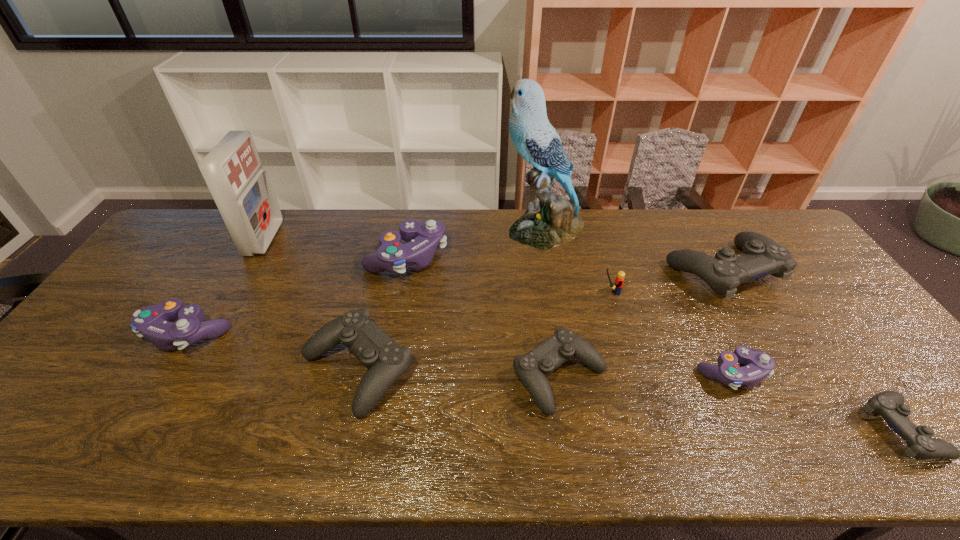
Where is `free region located on the front-facing side of the Lego`? The image size is (960, 540). free region located on the front-facing side of the Lego is located at coordinates (538, 292).

At what (x,y) coordinates should I click in order to perform the action: click on free space located on the front-facing side of the Lego. Please return your answer as a coordinate pair (x, y). The width and height of the screenshot is (960, 540). Looking at the image, I should click on (578, 292).

Where is `blank space located 0.110m on the right of the second biggest purple control`? This screenshot has width=960, height=540. blank space located 0.110m on the right of the second biggest purple control is located at coordinates (270, 333).

The width and height of the screenshot is (960, 540). In order to click on vacant space located on the back of the leftmost gray control in this screenshot , I will do [x=372, y=307].

Identify the location of free space located 0.120m on the left of the second gray control from left to right. (464, 376).

This screenshot has width=960, height=540. I want to click on free location located 0.070m on the back of the smallest purple control, so click(709, 331).

Where is `parakeet that is at the far edge`? parakeet that is at the far edge is located at coordinates (551, 220).

You are a GUI agent. You are given a task and a screenshot of the screen. Output one action in this format:
    pyautogui.click(x=<x>, y=<y>)
    Task: Click on the first-aid kit situated at the far edge
    
    Given the screenshot: What is the action you would take?
    pyautogui.click(x=232, y=170)

Identify the location of object present at the right edge. The image size is (960, 540). (762, 256).

You are a GUI agent. You are given a task and a screenshot of the screen. Output one action in this format:
    pyautogui.click(x=<x>, y=<y>)
    Task: Click on the object that is at the far right corner
    This screenshot has width=960, height=540.
    Given the screenshot: What is the action you would take?
    pyautogui.click(x=762, y=256)